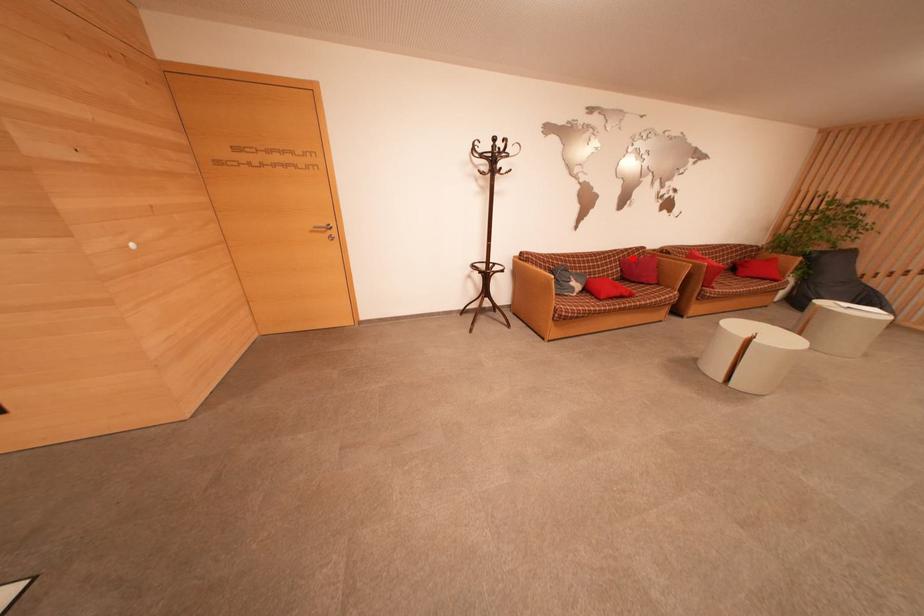
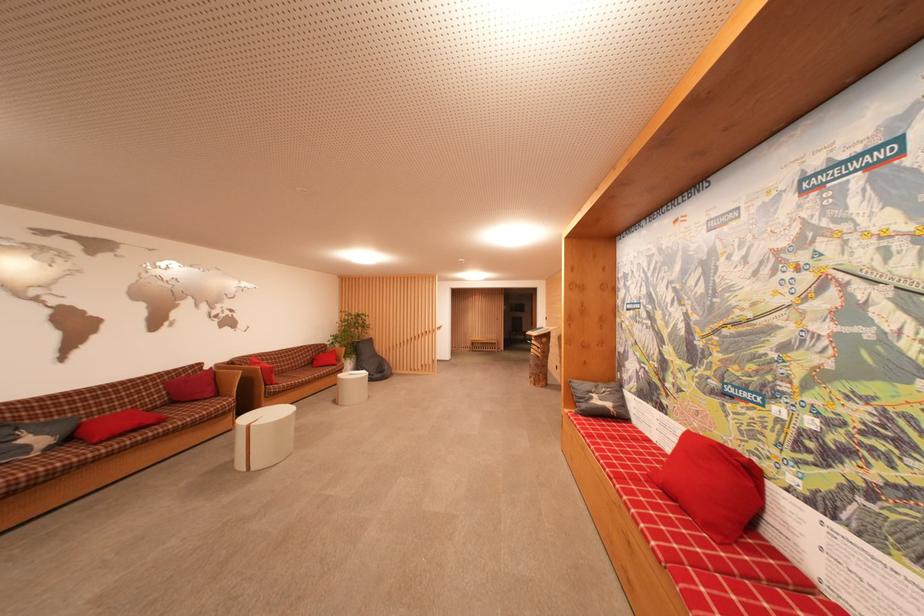
Question: I am providing you with two images of the same scene from different viewpoints. In image1, a red point is highlighted. Considering the same 3D point in image2, which of the following is correct?

Choices:
 (A) It is closer
 (B) It is farther

Answer: (B)